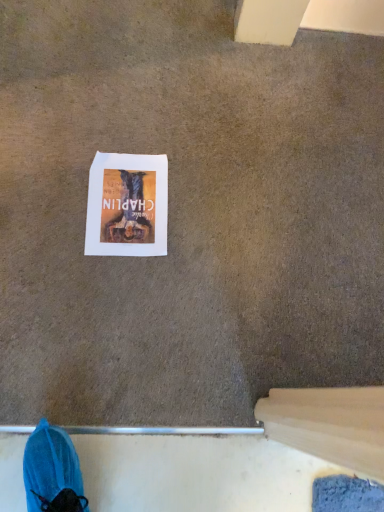
The width and height of the screenshot is (384, 512). I want to click on free point below white paper at center (from a real-world perspective), so click(122, 205).